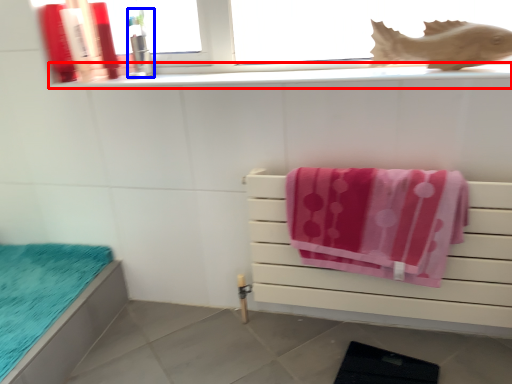
Question: Which object appears farthest to the camera in this image, window sill (highlighted by a red box) or toiletry (highlighted by a blue box)?

Choices:
 (A) window sill
 (B) toiletry

Answer: (B)